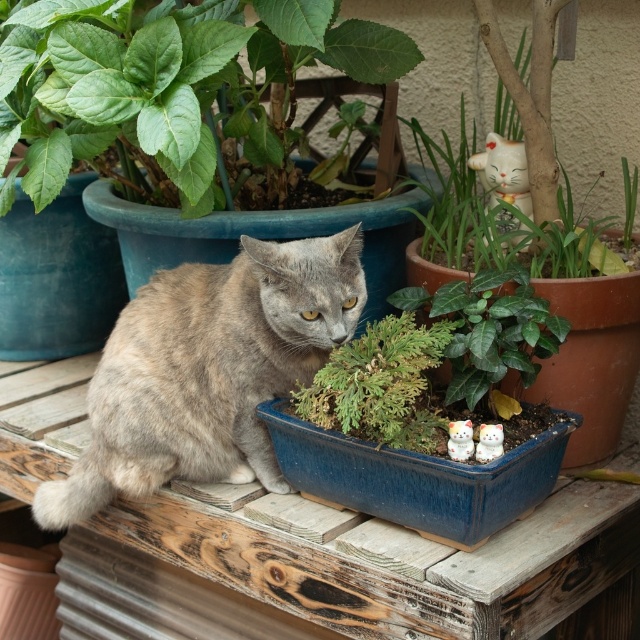
Is green matte plant at upper left to the left of white glossy cat at upper right from the viewer's perspective?

Indeed, green matte plant at upper left is positioned on the left side of white glossy cat at upper right.

The width and height of the screenshot is (640, 640). What do you see at coordinates (179, 97) in the screenshot? I see `green matte plant at upper left` at bounding box center [179, 97].

Which is in front, point (349, 48) or point (493, 193)?

Point (493, 193)

What are the coordinates of `green matte plant at upper left` in the screenshot? It's located at (179, 97).

Can you confirm if green matte plant at center is wider than white glossy cat at upper right?

Correct, the width of green matte plant at center exceeds that of white glossy cat at upper right.

Is green matte plant at center closer to camera compared to white glossy cat at upper right?

That is True.

Does point (305, 397) lie in front of point (515, 170)?

Yes, point (305, 397) is in front of point (515, 170).

The width and height of the screenshot is (640, 640). Identify the location of green matte plant at center. (381, 385).

Does green matte plant at upper left have a greater height compared to green glossy plant at center?

Indeed, green matte plant at upper left has a greater height compared to green glossy plant at center.

Can you confirm if green matte plant at upper left is wider than green glossy plant at center?

Indeed, green matte plant at upper left has a greater width compared to green glossy plant at center.

Is point (349, 33) positioned before point (515, 412)?

No, it is not.

The image size is (640, 640). Find the location of `green matte plant at upper left`. green matte plant at upper left is located at coordinates (179, 97).